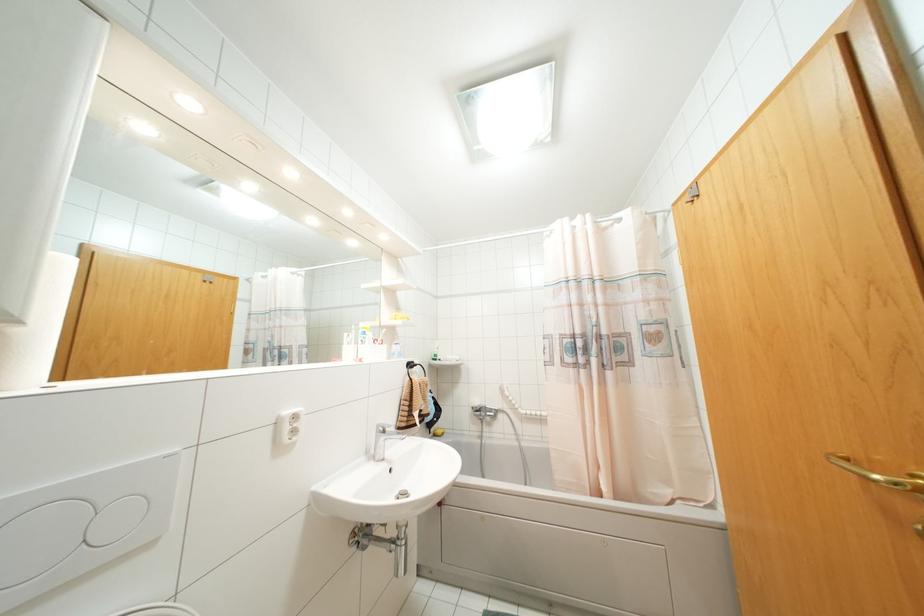
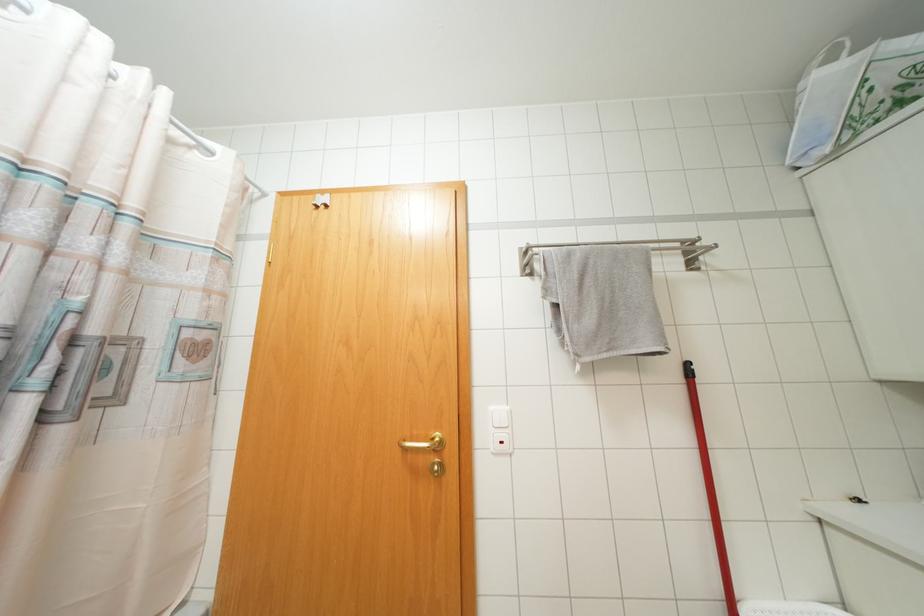
How did the camera likely rotate?

The rotation direction of the camera is right-up.